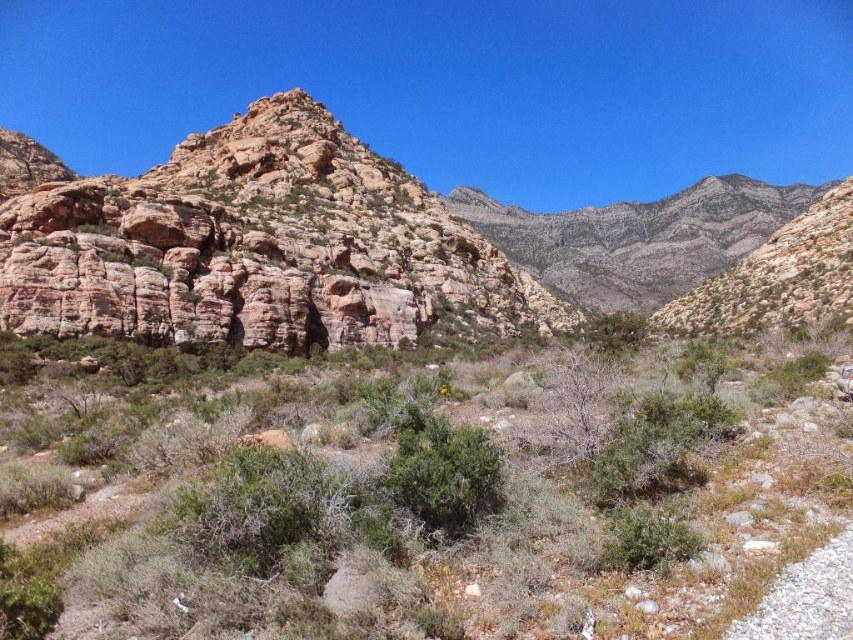
Based on the photo, who is taller, green shrubs at center or rusty rock formation at left?

With more height is rusty rock formation at left.

Who is more forward, (112,346) or (22,204)?

Point (112,346) is in front.

Between point (144, 628) and point (134, 332), which one is positioned behind?

The point (134, 332) is more distant.

Locate an element on the screen. This screenshot has height=640, width=853. green shrubs at center is located at coordinates (412, 499).